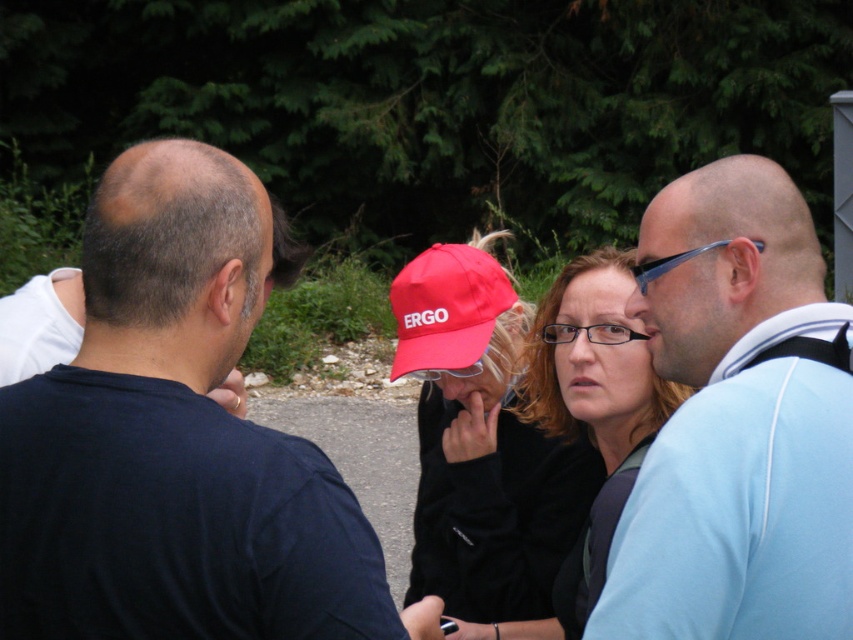
Question: Which of the following is the farthest from the observer?

Choices:
 (A) dark blue t-shirt at left
 (B) black matte jacket at center
 (C) light blue fabric shirt at right
 (D) matte red baseball cap at center

Answer: (D)

Question: Based on their relative distances, which object is farther from the dark blue t-shirt at left?

Choices:
 (A) light blue fabric shirt at right
 (B) black matte jacket at center
 (C) matte red baseball cap at center

Answer: (C)

Question: Which point is farther to the camera?

Choices:
 (A) (138, 557)
 (B) (560, 628)
 (C) (705, 598)
 (D) (439, 257)

Answer: (D)

Question: Does black matte jacket at center appear over matte red baseball cap at center?

Choices:
 (A) yes
 (B) no

Answer: (B)

Question: From the image, what is the correct spatial relationship of dark blue t-shirt at left in relation to matte red baseball cap at center?

Choices:
 (A) above
 (B) below

Answer: (B)

Question: Can you confirm if black matte jacket at center is smaller than matte red baseball cap at center?

Choices:
 (A) yes
 (B) no

Answer: (B)